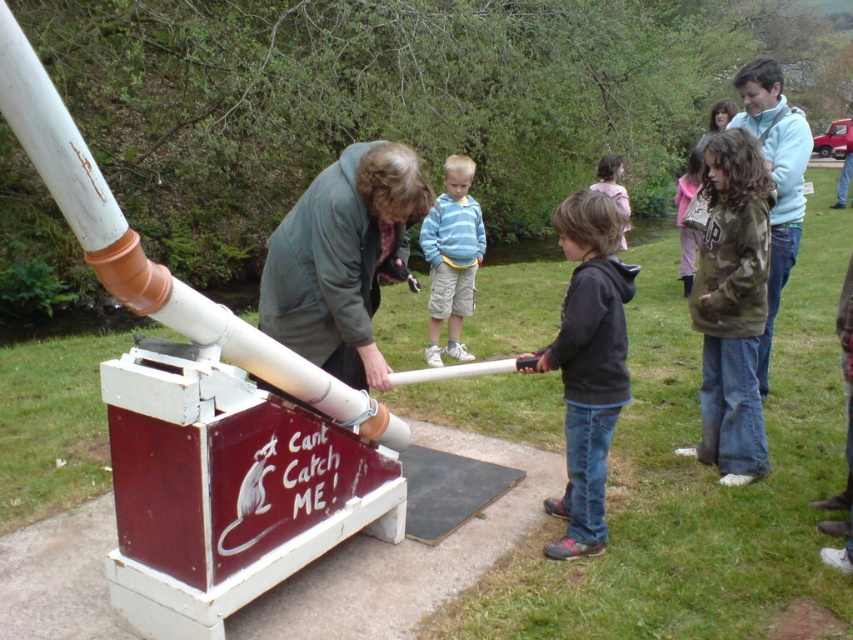
You are holding a camera and want to take a photo of the white matte pipe at center from a distance that is exactly 1.67 meters away. Is this possible based on the scene?

Yes, the white matte pipe at center and camera are 1.67 meters apart from each other, so taking the photo at that exact distance is possible.

You are standing in the park and want to take a photo of the cannon mounted on the red and white wooden base. The camera you are using has a maximum focus range of 5 meters. Is the point where you are standing, which is at coordinates point (229, 310), within the camera focus range to capture the cannon clearly?

The distance of point (229, 310) from viewer is 4.83 meters, which is within the camera focus range of 5 meters. Therefore, the camera can focus on the cannon clearly from that point.